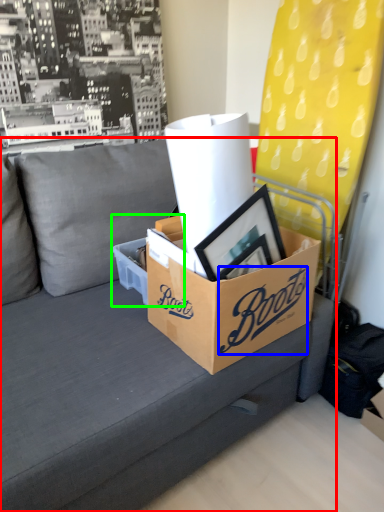
Question: Which object is the farthest from studio couch (highlighted by a red box)? Choose among these: writing (highlighted by a blue box) or box (highlighted by a green box).

Choices:
 (A) writing
 (B) box

Answer: (A)